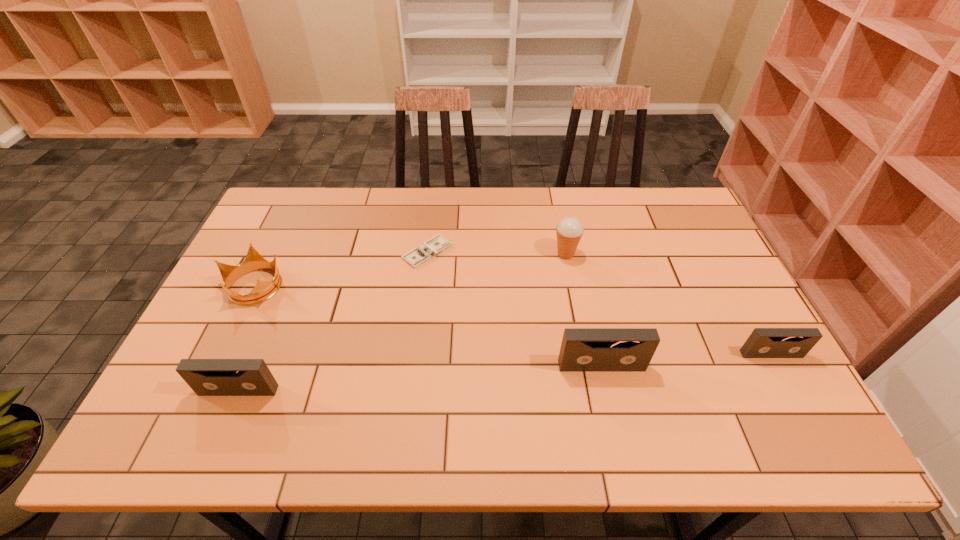
Identify the location of the leftmost videotape. The width and height of the screenshot is (960, 540). (206, 377).

At what (x,y) coordinates should I click in order to perform the action: click on the nearest videotape. Please return your answer as a coordinate pair (x, y). Looking at the image, I should click on (206, 377).

The height and width of the screenshot is (540, 960). I want to click on the second nearest object, so click(582, 349).

Locate an element on the screen. This screenshot has height=540, width=960. the second videotape from right to left is located at coordinates (582, 349).

You are a GUI agent. You are given a task and a screenshot of the screen. Output one action in this format:
    pyautogui.click(x=<x>, y=<y>)
    Task: Click on the third nearest object
    
    Given the screenshot: What is the action you would take?
    pyautogui.click(x=763, y=342)

Identify the location of the farthest videotape. This screenshot has width=960, height=540. (763, 342).

I want to click on icecream, so click(569, 230).

Locate an element on the screen. This screenshot has width=960, height=540. dollar is located at coordinates (423, 253).

Locate an element on the screen. the shortest object is located at coordinates (423, 253).

The image size is (960, 540). Identify the location of crown. (262, 291).